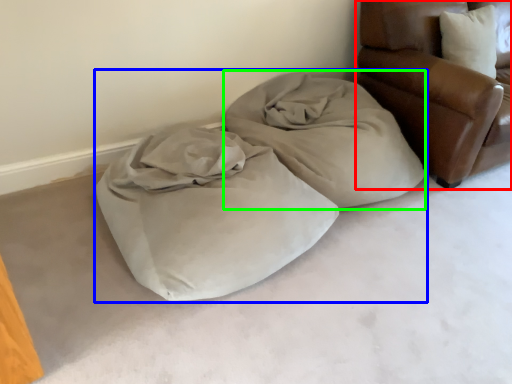
Question: Considering the real-world distances, which object is closest to furniture (highlighted by a red box)? bed (highlighted by a blue box) or cloth (highlighted by a green box).

Choices:
 (A) bed
 (B) cloth

Answer: (B)